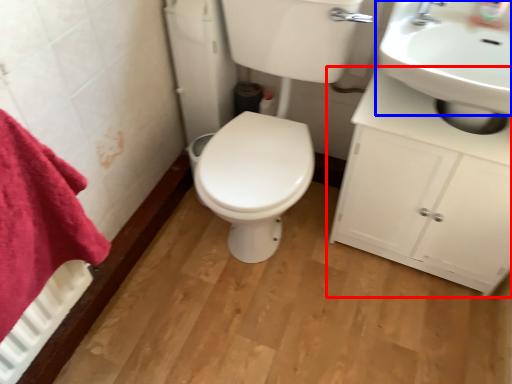
Question: Among these objects, which one is nearest to the camera, bathroom cabinet (highlighted by a red box) or sink (highlighted by a blue box)?

Choices:
 (A) bathroom cabinet
 (B) sink

Answer: (B)